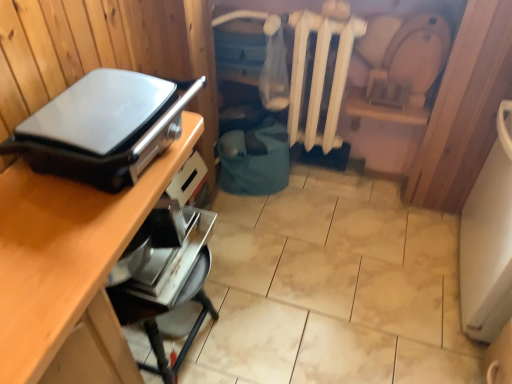
Image resolution: width=512 pixels, height=384 pixels. In order to click on free space in front of matte black appliance at left, which is the second appliance from bottom to top in this screenshot , I will do `click(55, 249)`.